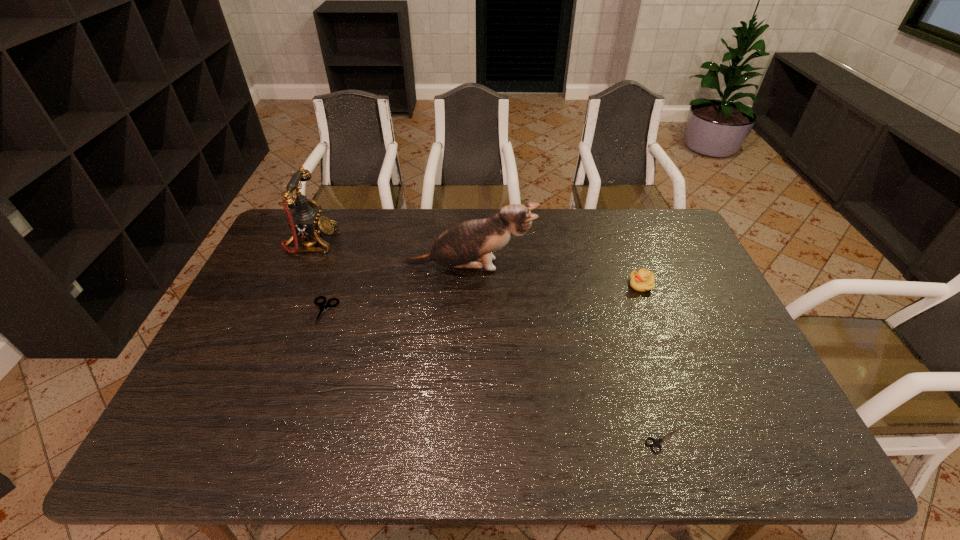
Locate an element on the screen. This screenshot has height=540, width=960. vacant area that lies between the third object from right to left and the telephone is located at coordinates (391, 254).

The image size is (960, 540). Find the location of `free area in between the leftmost object and the second object from left to right`. free area in between the leftmost object and the second object from left to right is located at coordinates (318, 276).

Choose which object is the fourth nearest neighbor to the telephone. Please provide its 2D coordinates. Your answer should be formatted as a tuple, i.e. [(x, y)], where the tuple contains the x and y coordinates of a point satisfying the conditions above.

[(657, 442)]

This screenshot has height=540, width=960. Identify the location of object that is the second closest to the second shortest object. (474, 240).

Locate an element on the screen. This screenshot has width=960, height=540. free space that satisfies the following two spatial constraints: 1. on the front of the right shears, featuring the rotary dial; 2. on the right side of the telephone is located at coordinates (224, 440).

Find the location of a particular element. free space in the image that satisfies the following two spatial constraints: 1. on the front of the telephone, featuring the rotary dial; 2. on the left side of the fourth object from right to left is located at coordinates (281, 311).

Where is `vacant region that satisfies the following two spatial constraints: 1. on the front-facing side of the third tallest object; 2. on the front side of the shorter shears`? Image resolution: width=960 pixels, height=540 pixels. vacant region that satisfies the following two spatial constraints: 1. on the front-facing side of the third tallest object; 2. on the front side of the shorter shears is located at coordinates click(701, 440).

Where is `vacant space that satisfies the following two spatial constraints: 1. on the front of the leftmost object, featuring the rotary dial; 2. on the left side of the shorter shears`? vacant space that satisfies the following two spatial constraints: 1. on the front of the leftmost object, featuring the rotary dial; 2. on the left side of the shorter shears is located at coordinates (224, 440).

The height and width of the screenshot is (540, 960). Identify the location of vacant region that satisfies the following two spatial constraints: 1. on the back side of the nearer shears; 2. on the front of the telephone, featuring the rotary dial. (602, 242).

Locate an element on the screen. The height and width of the screenshot is (540, 960). free spot that satisfies the following two spatial constraints: 1. on the back side of the shorter shears; 2. at the face of the cat is located at coordinates (610, 266).